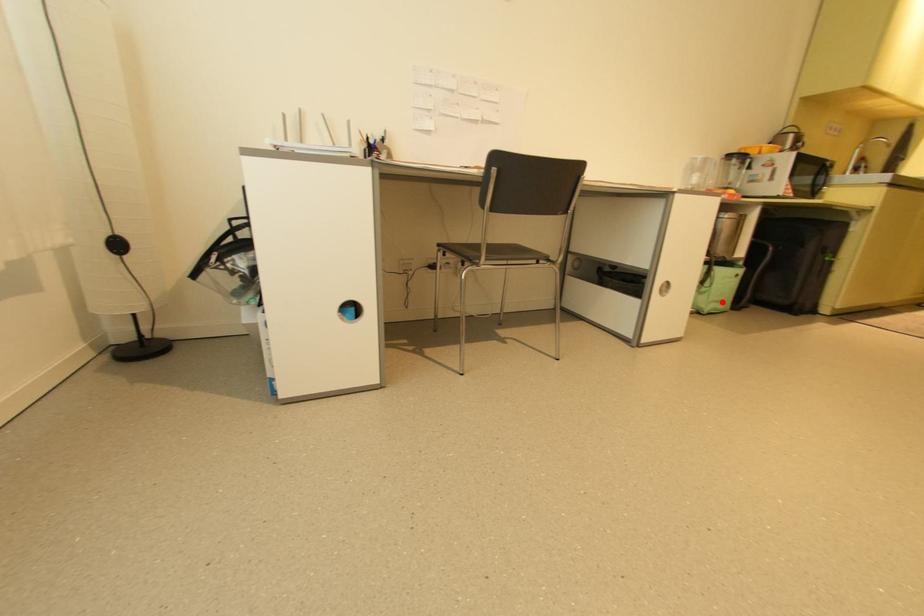
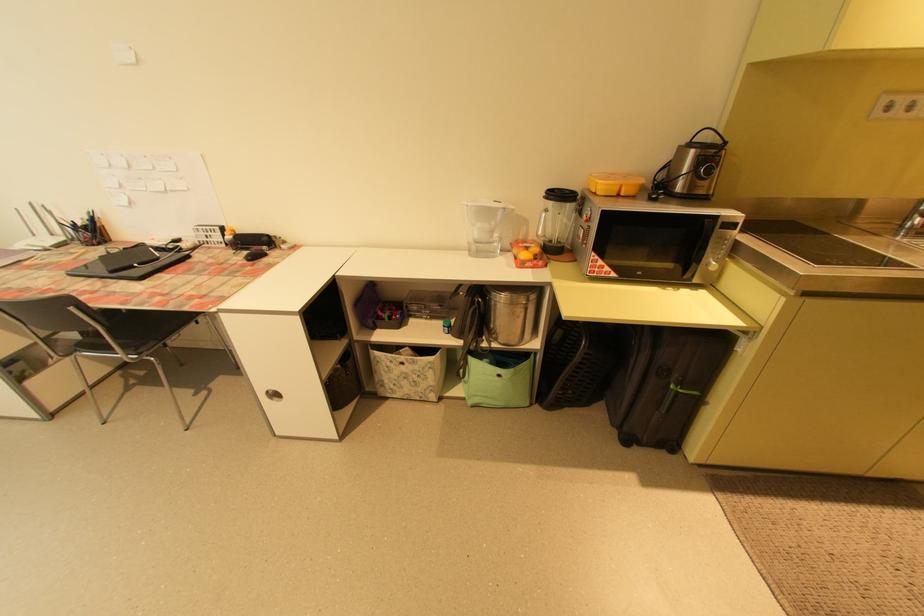
Where in the second image is the point corresponding to the highlighted location from the first image?

(492, 398)